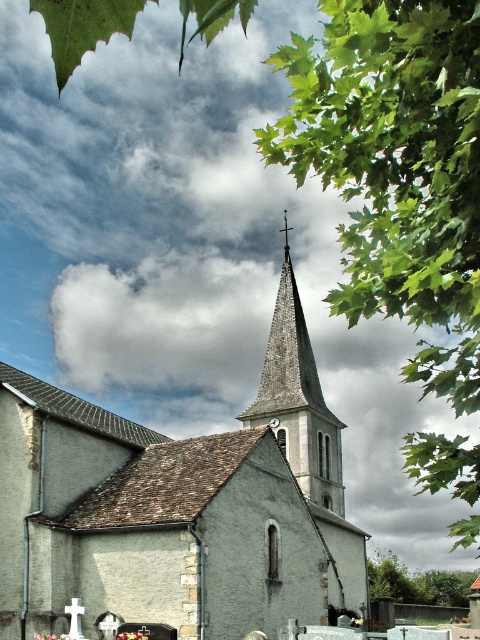
Question: Is gray stone church steeple at center in front of gray stone spire at center?

Choices:
 (A) yes
 (B) no

Answer: (A)

Question: Considering the relative positions of gray stone church steeple at center and gray stone spire at center in the image provided, where is gray stone church steeple at center located with respect to gray stone spire at center?

Choices:
 (A) right
 (B) left

Answer: (B)

Question: Which of the following is the closest to the observer?

Choices:
 (A) (254, 426)
 (B) (268, 576)

Answer: (B)

Question: Which point appears closest to the camera in this image?

Choices:
 (A) (291, 316)
 (B) (312, 611)

Answer: (B)

Question: Does gray stone church steeple at center come in front of gray stone spire at center?

Choices:
 (A) yes
 (B) no

Answer: (A)